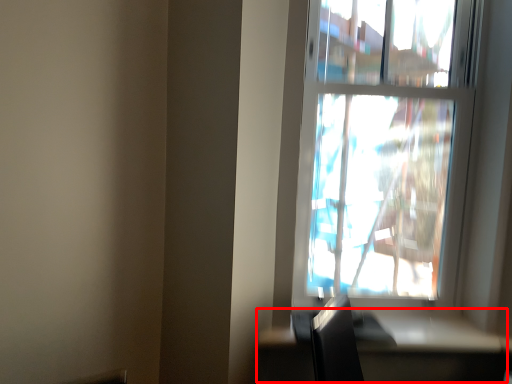
Question: In this image, where is table (annotated by the red box) located relative to window?

Choices:
 (A) right
 (B) left

Answer: (B)